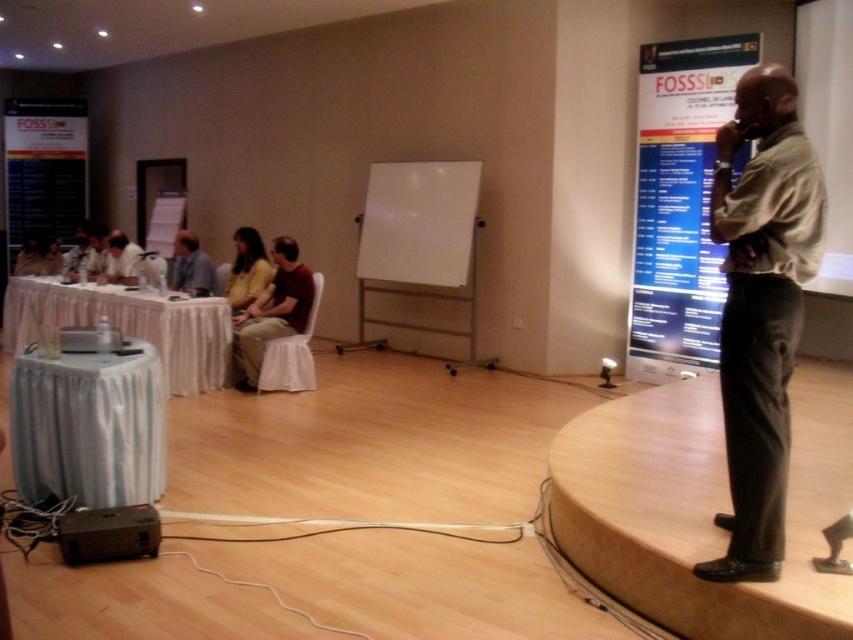
From the picture: You are an event organizer checking the seating arrangement. You notice the khaki cotton shirt at right and the white draped table at left. Which object is narrower?

The khaki cotton shirt at right has a lesser width compared to the white draped table at left, so the khaki cotton shirt at right is narrower.

You are an attendee at this conference and want to move from your seat to the blue glossy poster at upper right. Which direction should you walk relative to the yellow fabric chair at center?

The blue glossy poster at upper right is to the right of the yellow fabric chair at center, so you should walk to the right side of the yellow fabric chair at center to reach it.